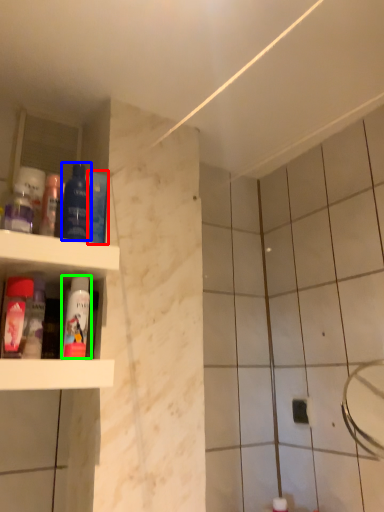
Question: Considering the real-world distances, which object is farthest from mouthwash (highlighted by a red box)? mouthwash (highlighted by a blue box) or mouthwash (highlighted by a green box)?

Choices:
 (A) mouthwash
 (B) mouthwash

Answer: (B)